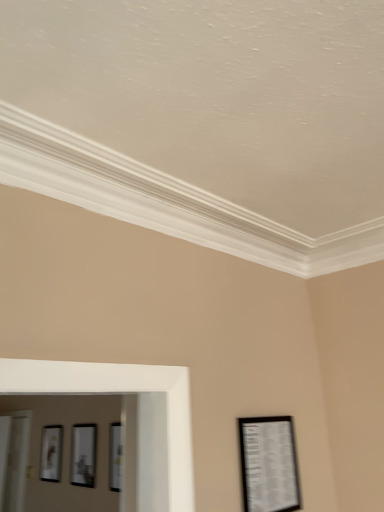
Question: Is point (249, 418) closer or farther from the camera than point (79, 437)?

Choices:
 (A) closer
 (B) farther

Answer: (A)

Question: From the image's perspective, relative to matte black picture frame at center, the second picture frame from the front, is matte black picture frame at lower right, the third picture frame in the back-to-front sequence, above or below?

Choices:
 (A) above
 (B) below

Answer: (A)

Question: Which object is the closest to the matte black picture frame at left, the 3th picture frame positioned from the right?

Choices:
 (A) matte black picture frame at lower right, which is the third picture frame in left-to-right order
 (B) matte black picture frame at center, which ranks as the second picture frame in back-to-front order

Answer: (B)

Question: Which object is positioned closest to the matte black picture frame at lower right, which is the third picture frame in left-to-right order?

Choices:
 (A) matte black picture frame at left, the first picture frame from the left
 (B) matte black picture frame at center, which ranks as the second picture frame in back-to-front order

Answer: (B)